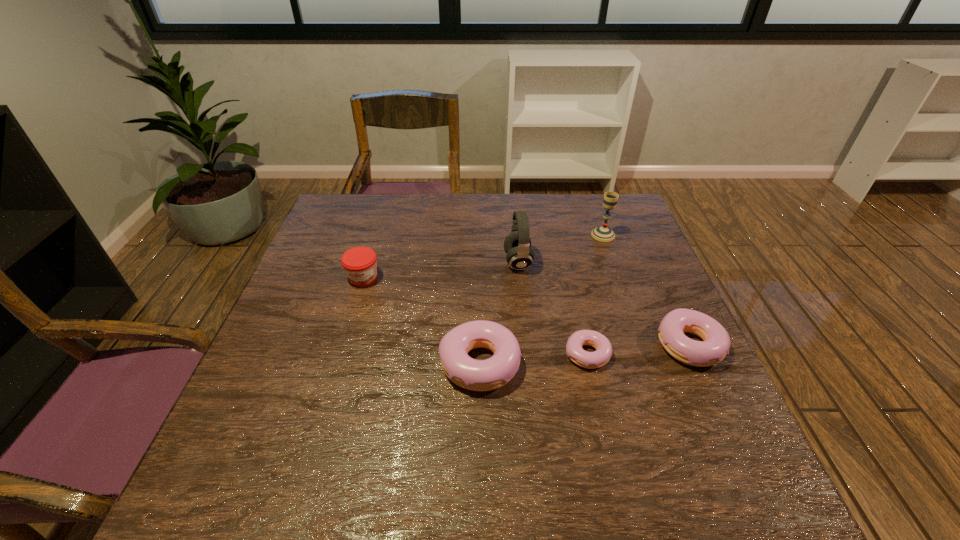
The doughnuts are evenly distributed in the image. To maintain this, where would you place another doughnut on the left? Please point to a free space. Please provide its 2D coordinates. Your answer should be formatted as a tuple, i.e. [(x, y)], where the tuple contains the x and y coordinates of a point satisfying the conditions above.

[(369, 372)]